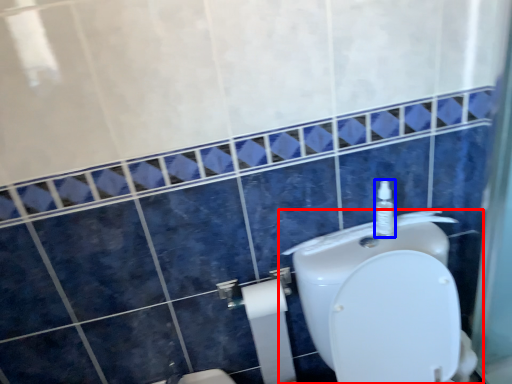
Question: Which object is further to the camera taking this photo, toilet (highlighted by a red box) or soap dispenser (highlighted by a blue box)?

Choices:
 (A) toilet
 (B) soap dispenser

Answer: (B)